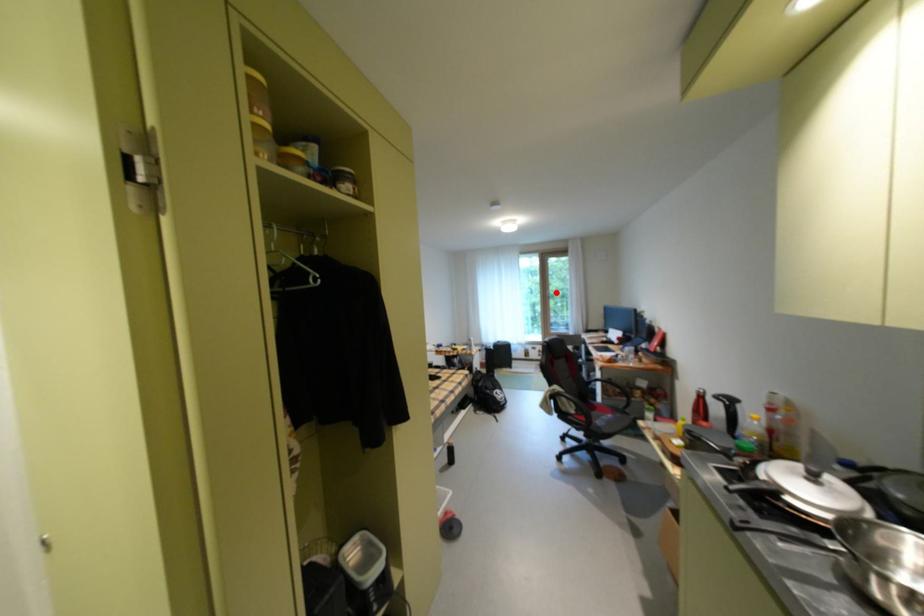
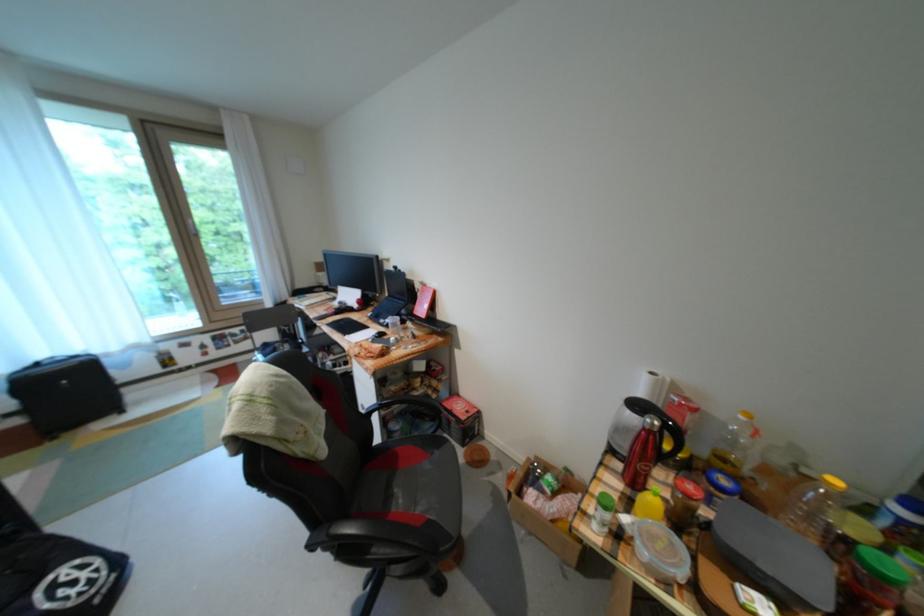
Question: I am providing you with two images of the same scene from different viewpoints. In image1, a red point is highlighted. Considering the same 3D point in image2, which of the following is correct?

Choices:
 (A) It is closer
 (B) It is farther

Answer: (B)